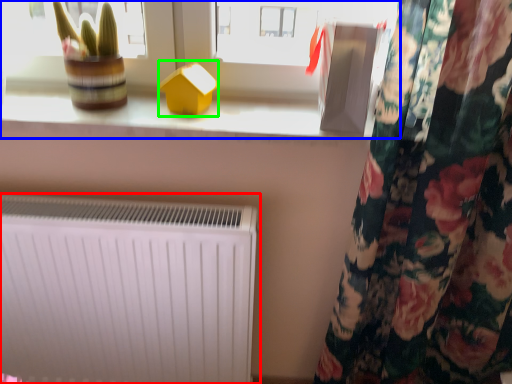
Question: Based on their relative distances, which object is farther from radiator (highlighted by a red box)? Choose from window (highlighted by a blue box) and toy (highlighted by a green box).

Choices:
 (A) window
 (B) toy

Answer: (B)